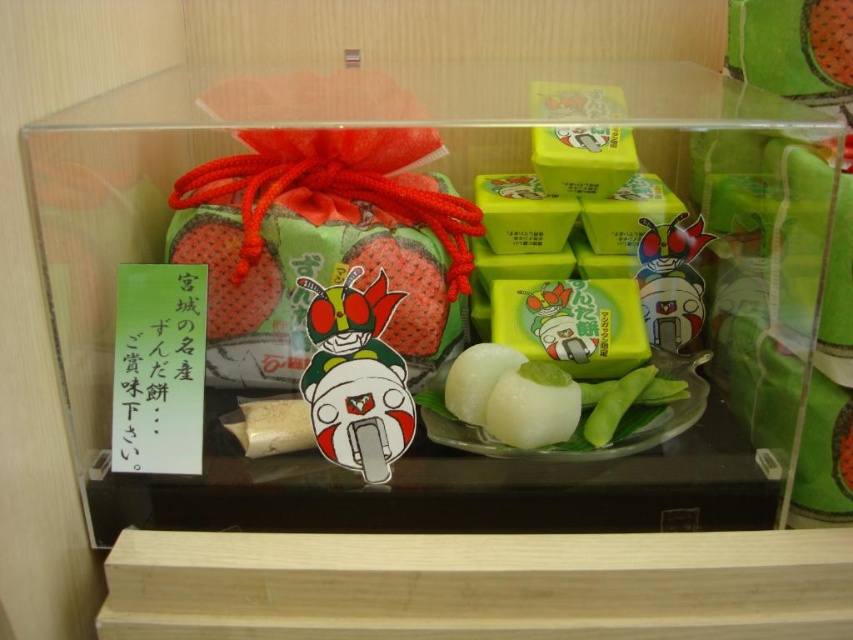
You are a store employee arranging items in the display case. You have a matte plastic toy at center and a smooth red strawberry at center. Which item takes up more space in the display case?

The smooth red strawberry at center takes up more space in the display case than the matte plastic toy at center because the matte plastic toy at center occupies less space than smooth red strawberry at center.

You are a customer standing in front of the display case. You want to place a new item exactly at the center of the display. Is the current position of the matte plastic toy at center already at the center of the display case?

The matte plastic toy at center is positioned at point (357, 376), which is close to the center coordinates of the display case. However, since the exact center would be at point (426, 320), it is slightly offset to the right and down from the true center. Therefore, the matte plastic toy at center is not exactly at the center of the display case.